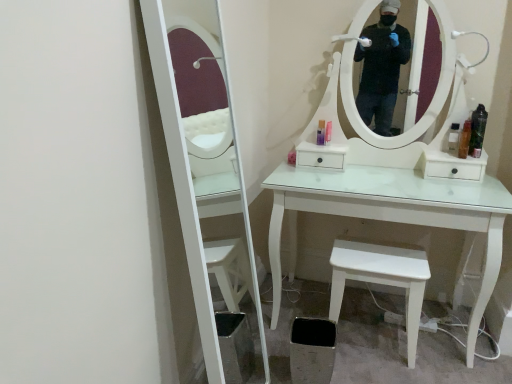
Question: From a real-world perspective, is translucent plastic bottle at right, the fourth toiletry when ordered from left to right, positioned under translucent plastic bottle at right, the 1th toiletry viewed from the right, based on gravity?

Choices:
 (A) yes
 (B) no

Answer: (A)

Question: Is translucent plastic bottle at right, the fourth toiletry when ordered from left to right, not near translucent plastic bottle at right, the 1th toiletry viewed from the right?

Choices:
 (A) yes
 (B) no

Answer: (B)

Question: Is translucent plastic bottle at right, the fourth toiletry when ordered from left to right, located outside translucent plastic bottle at right, placed as the 5th toiletry when sorted from left to right?

Choices:
 (A) yes
 (B) no

Answer: (A)

Question: Is translucent plastic bottle at right, the fourth toiletry when ordered from left to right, oriented away from translucent plastic bottle at right, placed as the 5th toiletry when sorted from left to right?

Choices:
 (A) yes
 (B) no

Answer: (B)

Question: Is translucent plastic bottle at right, acting as the 2th toiletry starting from the right, to the right of translucent plastic bottle at right, the 1th toiletry viewed from the right, from the viewer's perspective?

Choices:
 (A) no
 (B) yes

Answer: (A)

Question: From a real-world perspective, is translucent plastic bottle at right, the fourth toiletry when ordered from left to right, positioned over translucent plastic bottle at right, placed as the 5th toiletry when sorted from left to right, based on gravity?

Choices:
 (A) no
 (B) yes

Answer: (A)

Question: Is pink plastic bottle at center, which appears as the second toiletry when viewed from the left, further to the viewer compared to white matte stool at lower right?

Choices:
 (A) yes
 (B) no

Answer: (A)

Question: From a real-world perspective, is pink plastic bottle at center, which appears as the second toiletry when viewed from the left, on white matte stool at lower right?

Choices:
 (A) no
 (B) yes

Answer: (B)

Question: Does pink plastic bottle at center, which appears as the second toiletry when viewed from the left, turn towards white matte stool at lower right?

Choices:
 (A) no
 (B) yes

Answer: (A)

Question: Does pink plastic bottle at center, marked as the 4th toiletry in a right-to-left arrangement, contain white matte stool at lower right?

Choices:
 (A) no
 (B) yes

Answer: (A)

Question: From a real-world perspective, does pink plastic bottle at center, marked as the 4th toiletry in a right-to-left arrangement, sit lower than white matte stool at lower right?

Choices:
 (A) yes
 (B) no

Answer: (B)

Question: Is pink plastic bottle at center, which appears as the second toiletry when viewed from the left, placed right next to white matte stool at lower right?

Choices:
 (A) yes
 (B) no

Answer: (B)

Question: Can you confirm if white matte stool at lower right is thinner than clear plastic bottle at right, the third toiletry when ordered from left to right?

Choices:
 (A) no
 (B) yes

Answer: (A)